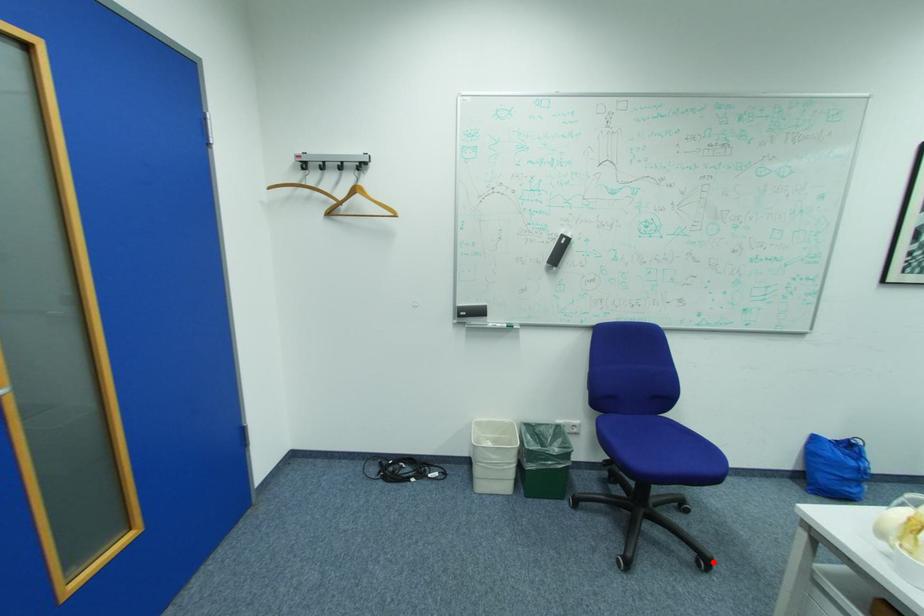
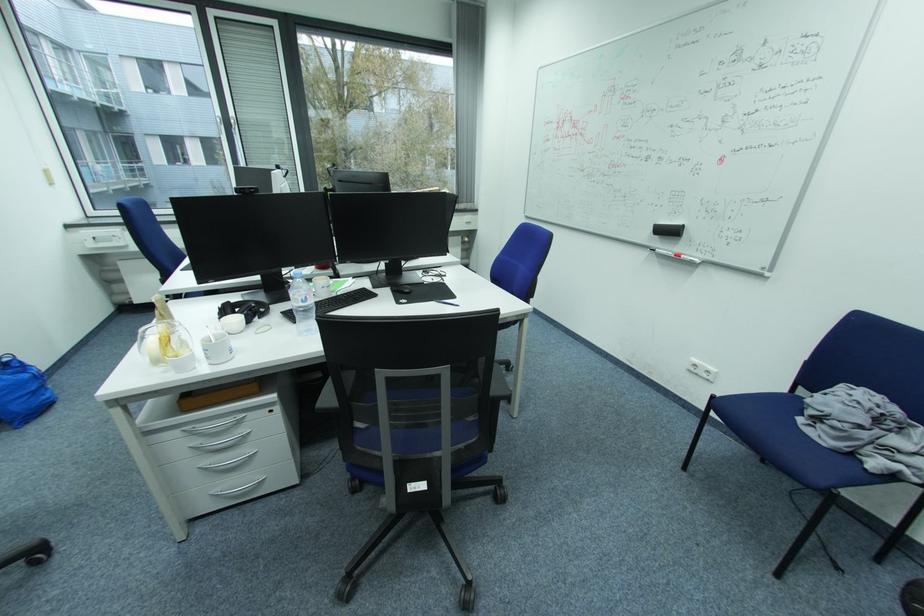
Locate, in the second image, the point that corresponds to the highlighted location in the first image.

(45, 554)